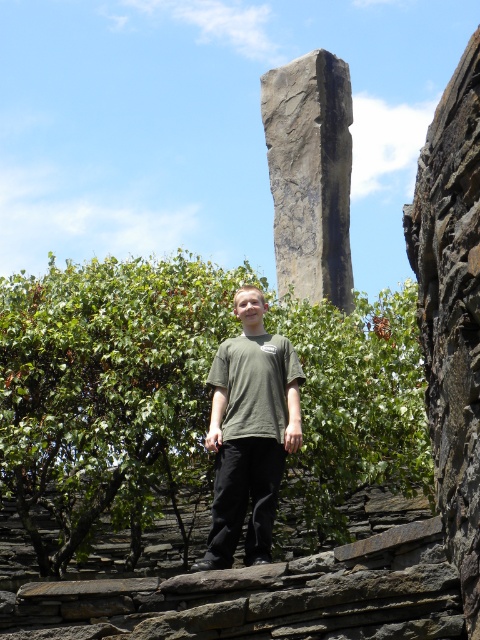
You are a photographer trying to capture a photo of the green matte shirt at center and the rusty stone wall at right. If you want to ensure both are fully visible in the frame, which object should you adjust your camera angle to focus on first?

The rusty stone wall at right is taller than the green matte shirt at center, so you should focus on framing the rusty stone wall at right first to ensure its full height is captured, then adjust to include the green matte shirt at center.

You are a photographer trying to capture the gray rough stone at center and the green matte shirt at center in your shot. Which object should you focus on first if you want to ensure both are in focus?

You should focus on the gray rough stone at center first because it is closer to the viewer than the green matte shirt at center, so adjusting focus from near to far will help both be in focus.

You are a photographer planning to take a wide shot of the scene. You need to ensure both the rusty stone wall at right and the gray rough stone at center are fully visible in the frame. Given their sizes, which object might require you to adjust your camera angle to include it properly?

The rusty stone wall at right has a smaller size compared to gray rough stone at center, so it might be easier to include in the frame. However, since the gray rough stone at center is larger and positioned centrally, it might dominate the frame, requiring careful composition to ensure both are visible. Alternatively, the smaller rusty stone wall at right could be positioned at the edge, while the larger gray rough stone at center takes up more space, necessitating an angle that balances both elements.